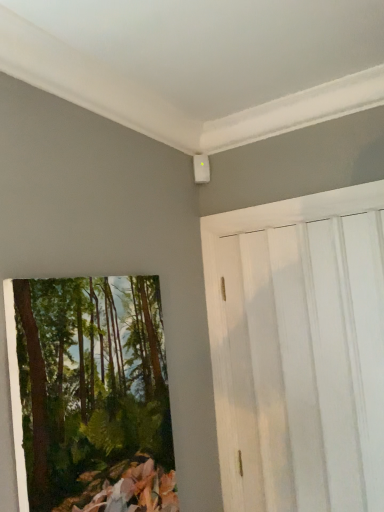
Question: From the image's perspective, is green textured painting at left below white wood barn door at upper right?

Choices:
 (A) no
 (B) yes

Answer: (B)

Question: From the image's perspective, would you say green textured painting at left is positioned over white wood barn door at upper right?

Choices:
 (A) no
 (B) yes

Answer: (A)

Question: Does green textured painting at left have a lesser width compared to white wood barn door at upper right?

Choices:
 (A) no
 (B) yes

Answer: (A)

Question: Is green textured painting at left far from white wood barn door at upper right?

Choices:
 (A) yes
 (B) no

Answer: (B)

Question: Considering the relative sizes of green textured painting at left and white wood barn door at upper right in the image provided, is green textured painting at left shorter than white wood barn door at upper right?

Choices:
 (A) yes
 (B) no

Answer: (A)

Question: Is green textured painting at left surrounding white wood barn door at upper right?

Choices:
 (A) no
 (B) yes

Answer: (A)

Question: Is white wood barn door at upper right taller than green textured painting at left?

Choices:
 (A) yes
 (B) no

Answer: (A)

Question: Is white wood barn door at upper right positioned behind green textured painting at left?

Choices:
 (A) yes
 (B) no

Answer: (A)

Question: Is white wood barn door at upper right bigger than green textured painting at left?

Choices:
 (A) yes
 (B) no

Answer: (A)

Question: Could you tell me if white wood barn door at upper right is turned towards green textured painting at left?

Choices:
 (A) yes
 (B) no

Answer: (A)

Question: Does white wood barn door at upper right appear on the right side of green textured painting at left?

Choices:
 (A) yes
 (B) no

Answer: (A)

Question: Is white wood barn door at upper right closer to the viewer compared to green textured painting at left?

Choices:
 (A) no
 (B) yes

Answer: (A)

Question: From their relative heights in the image, would you say white wood barn door at upper right is taller or shorter than green textured painting at left?

Choices:
 (A) tall
 (B) short

Answer: (A)